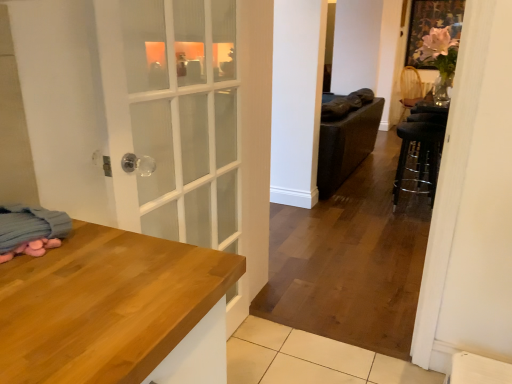
Question: In terms of height, does woven wicker chair at upper right look taller or shorter compared to black metal bar stool at right?

Choices:
 (A) short
 (B) tall

Answer: (B)

Question: In the image, is woven wicker chair at upper right on the left side or the right side of black metal bar stool at right?

Choices:
 (A) left
 (B) right

Answer: (B)

Question: Based on their relative distances, which object is nearer to the woven wicker chair at upper right?

Choices:
 (A) black metal bar stool at right
 (B) blue soft blanket at lower left

Answer: (A)

Question: Considering the real-world distances, which object is farthest from the blue soft blanket at lower left?

Choices:
 (A) woven wicker chair at upper right
 (B) black metal bar stool at right

Answer: (A)